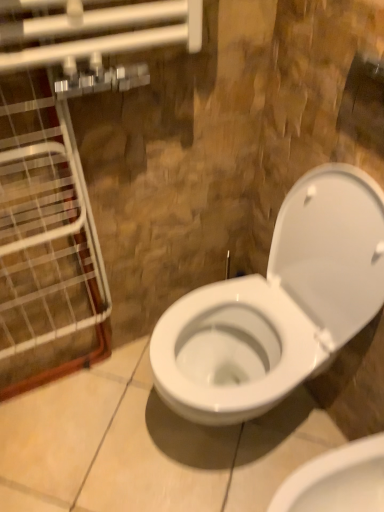
The height and width of the screenshot is (512, 384). Find the location of `free space below clear glass door at left (from a real-world perspective)`. free space below clear glass door at left (from a real-world perspective) is located at coordinates (69, 384).